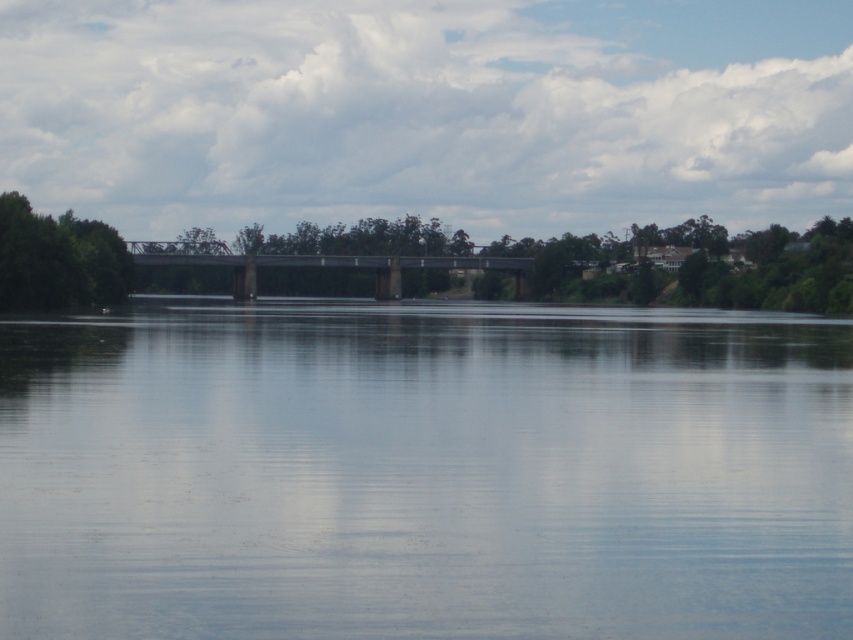
You are standing on the riverbank and want to take a photo of both the transparent water at center and the gray metallic bridge at center. Which object should you focus on first to ensure both are in clear view?

You should focus on the transparent water at center first because it is closer to the viewer than the gray metallic bridge at center, ensuring both are in clear view when focused properly.

You are standing at the origin point of the image coordinate system. You want to walk to the transparent water at center. In which direction should you move? The coordinate system has the origin at the bottom left corner, with x increasing to the right and y increasing upwards.

Since the transparent water at center is located at coordinate point (425, 472), you should move to the right and slightly upwards from the origin to reach it.

You are standing at the riverbank and want to take a photo of the green leafy tree at left. If your camera can focus on objects up to 450 feet away, will you be able to capture a clear image of the tree?

The green leafy tree at left is 449.11 feet from viewer, so yes, the camera can focus on it clearly since it is within the 450 feet range.